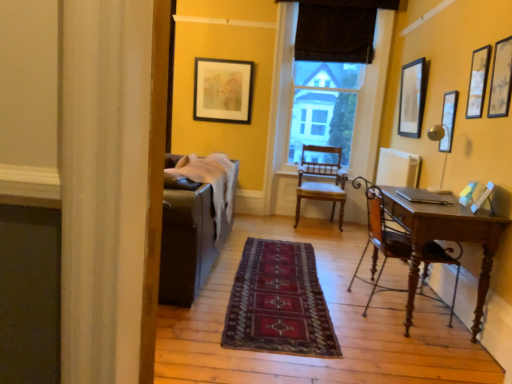
Question: From a real-world perspective, is wooden chair at right, marked as the 2th chair in a back-to-front arrangement, positioned above or below dark brown fabric at center?

Choices:
 (A) below
 (B) above

Answer: (A)

Question: In the image, is wooden chair at right, the 1th chair when ordered from front to back, on the left side or the right side of dark brown fabric at center?

Choices:
 (A) left
 (B) right

Answer: (B)

Question: Which of these objects is positioned closest to the matte black picture frame at upper center, the 1th picture frame in the back-to-front sequence?

Choices:
 (A) dark brown fabric at upper center
 (B) dark red woven rug at center
 (C) dark brown fabric at center
 (D) matte black picture frame at upper right, which is the 1th picture frame in right-to-left order
 (E) wooden chair at right, marked as the 2th chair in a back-to-front arrangement

Answer: (A)

Question: Which object is positioned closest to the matte black picture frame at upper center, which is counted as the first picture frame, starting from the left?

Choices:
 (A) dark brown fabric at center
 (B) wooden chair at center, the second chair when ordered from front to back
 (C) matte wooden picture frame at upper right, the fifth picture frame when ordered from back to front
 (D) metallic silver picture frame at upper right, the third picture frame positioned from the back
 (E) wooden chair at right, marked as the 2th chair in a back-to-front arrangement

Answer: (B)